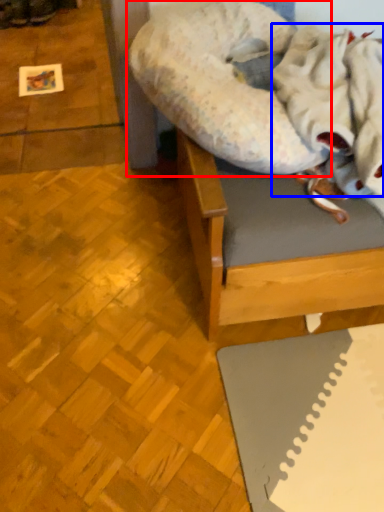
Question: Among these objects, which one is farthest to the camera, dog bed (highlighted by a red box) or blanket (highlighted by a blue box)?

Choices:
 (A) dog bed
 (B) blanket

Answer: (A)